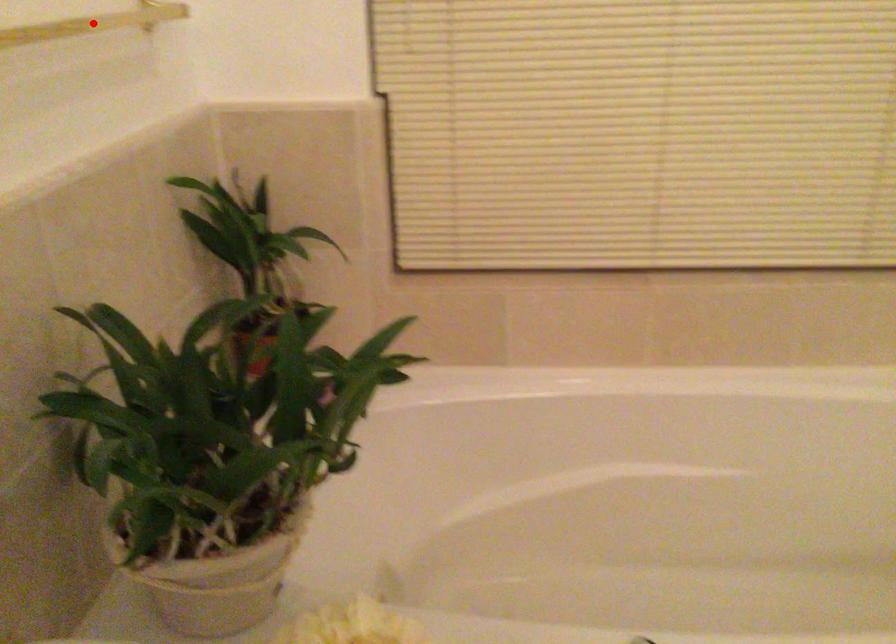
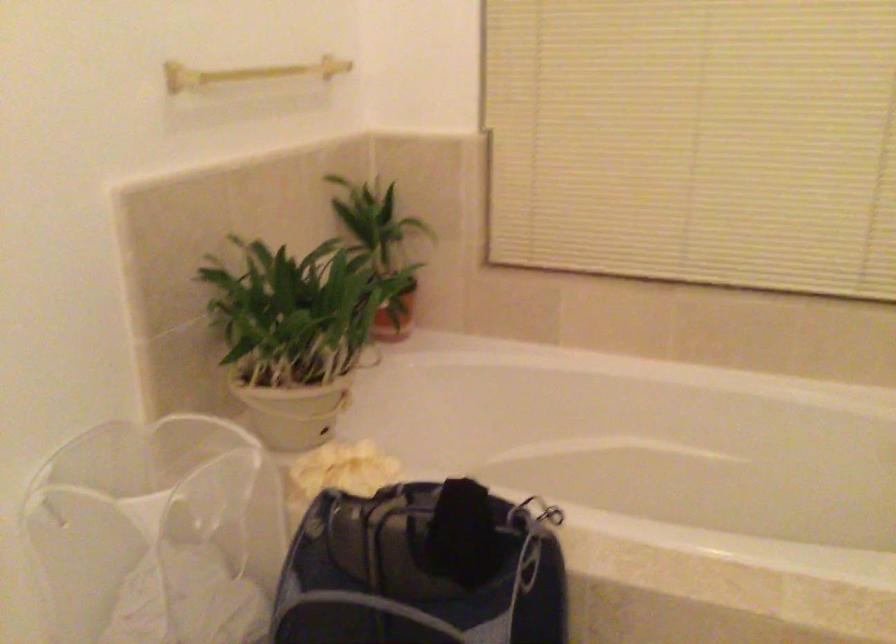
Question: I am providing you with two images of the same scene from different viewpoints. A red point is marked on the first image. At the location where the point appears in image 1, is it still visible in image 2?

Choices:
 (A) Yes
 (B) No

Answer: (B)